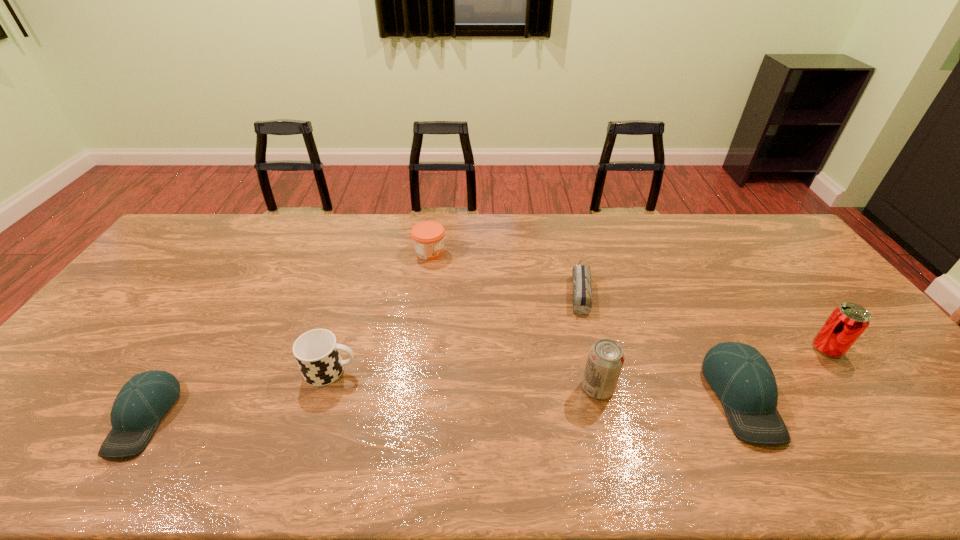
Please mark a free spot for a new baseball_cap to balance the arrangement. Please provide its 2D coordinates. Your answer should be formatted as a tuple, i.e. [(x, y)], where the tuple contains the x and y coordinates of a point satisfying the conditions above.

[(448, 407)]